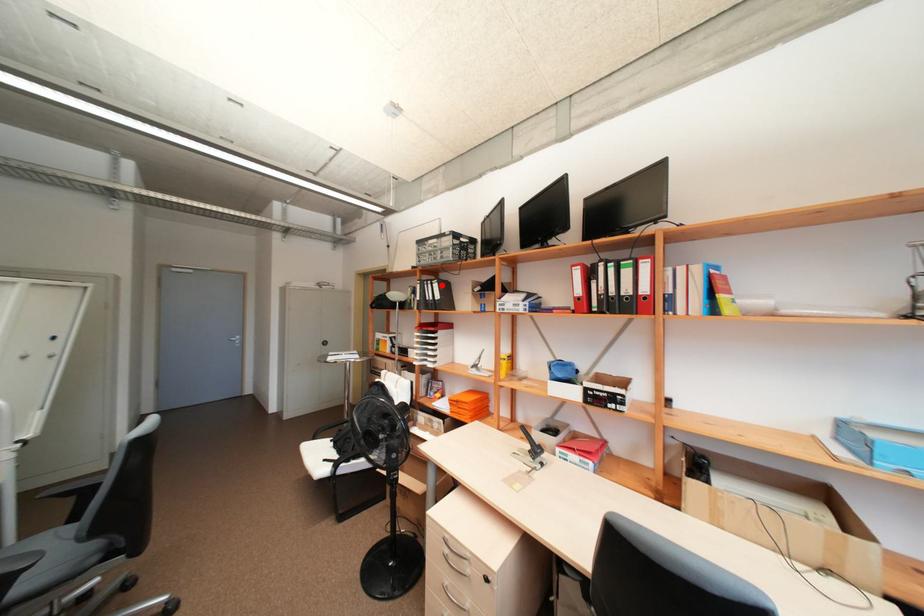
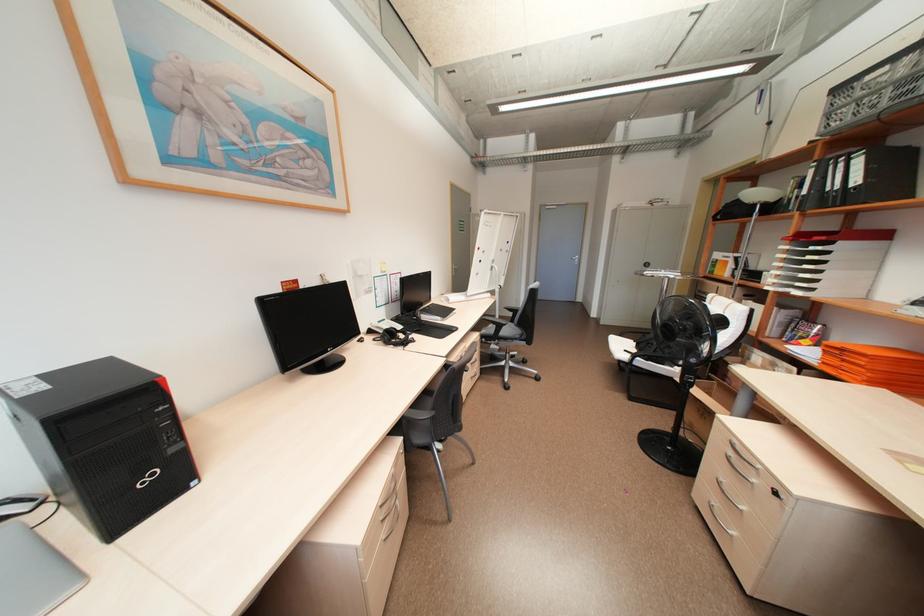
Locate, in the second image, the point that corresponds to the highlighted location in the first image.

(865, 161)